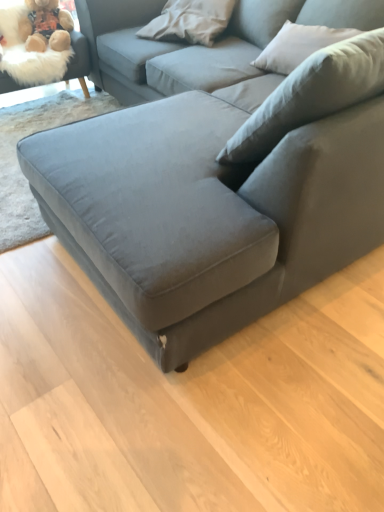
Question: Is velvet gray couch at center facing away from fluffy beige swivel chair at upper left?

Choices:
 (A) no
 (B) yes

Answer: (A)

Question: Is velvet gray couch at center thinner than fluffy beige swivel chair at upper left?

Choices:
 (A) yes
 (B) no

Answer: (B)

Question: Is velvet gray couch at center taller than fluffy beige swivel chair at upper left?

Choices:
 (A) yes
 (B) no

Answer: (A)

Question: Does velvet gray couch at center turn towards fluffy beige swivel chair at upper left?

Choices:
 (A) no
 (B) yes

Answer: (A)

Question: From a real-world perspective, is velvet gray couch at center positioned under fluffy beige swivel chair at upper left based on gravity?

Choices:
 (A) no
 (B) yes

Answer: (A)

Question: From a real-world perspective, relative to velvet gray couch at center, is fluffy beige swivel chair at upper left vertically above or below?

Choices:
 (A) above
 (B) below

Answer: (B)

Question: Considering the positions of point (84, 94) and point (261, 244), is point (84, 94) closer or farther from the camera than point (261, 244)?

Choices:
 (A) farther
 (B) closer

Answer: (A)

Question: Is fluffy beige swivel chair at upper left taller or shorter than velvet gray couch at center?

Choices:
 (A) short
 (B) tall

Answer: (A)

Question: Considering their positions, is fluffy beige swivel chair at upper left located in front of or behind velvet gray couch at center?

Choices:
 (A) behind
 (B) front

Answer: (A)

Question: In terms of width, does velvet gray couch at center look wider or thinner when compared to fuzzy beige teddy bear at upper left?

Choices:
 (A) wide
 (B) thin

Answer: (A)

Question: Does point (375, 211) appear closer or farther from the camera than point (52, 11)?

Choices:
 (A) farther
 (B) closer

Answer: (B)

Question: From a real-world perspective, is velvet gray couch at center physically located above or below fuzzy beige teddy bear at upper left?

Choices:
 (A) above
 (B) below

Answer: (B)

Question: In the image, is velvet gray couch at center positioned in front of or behind fuzzy beige teddy bear at upper left?

Choices:
 (A) front
 (B) behind

Answer: (A)

Question: Visually, is velvet gray couch at center positioned to the left or to the right of fluffy beige swivel chair at upper left?

Choices:
 (A) right
 (B) left

Answer: (A)

Question: From a real-world perspective, is velvet gray couch at center physically located above or below fluffy beige swivel chair at upper left?

Choices:
 (A) below
 (B) above

Answer: (B)